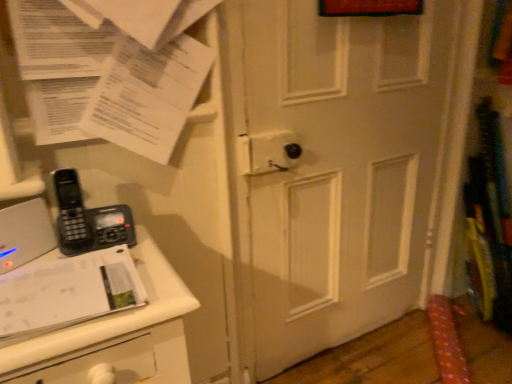
Question: Looking at their shapes, would you say black plastic phone at left is wider or thinner than white paper at upper left?

Choices:
 (A) thin
 (B) wide

Answer: (B)

Question: Considering the positions of black plastic phone at left and white paper at upper left in the image, is black plastic phone at left taller or shorter than white paper at upper left?

Choices:
 (A) short
 (B) tall

Answer: (A)

Question: Estimate the real-world distances between objects in this image. Which object is closer to the white glossy journal at lower left?

Choices:
 (A) white paper at upper left
 (B) white matte door at center
 (C) white plastic changing table at left
 (D) black plastic phone at left

Answer: (C)

Question: Which is farther from the black plastic phone at left?

Choices:
 (A) white glossy journal at lower left
 (B) white plastic changing table at left
 (C) white paper at upper left
 (D) white matte door at center

Answer: (D)